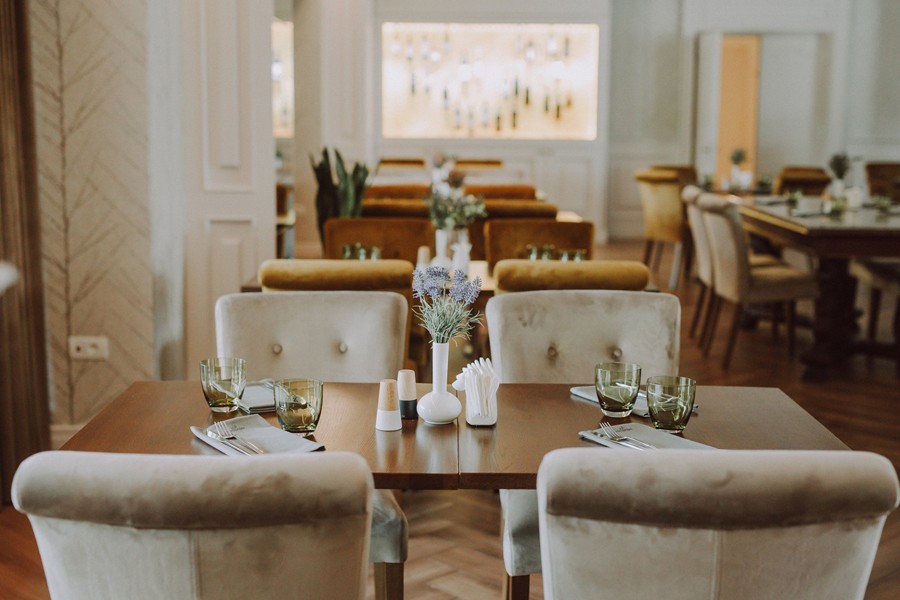
Locate an element on the screen. wood tables is located at coordinates (529, 417), (352, 417), (486, 272), (570, 213), (541, 195), (804, 223).